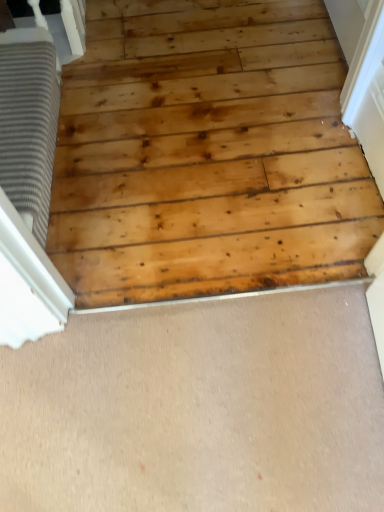
In order to face natural wood floor at upper left, should I rotate leftwards or rightwards?

Turn right approximately 2.594 degrees to face it.

The width and height of the screenshot is (384, 512). Describe the element at coordinates (207, 154) in the screenshot. I see `natural wood floor at upper left` at that location.

The width and height of the screenshot is (384, 512). I want to click on natural wood floor at upper left, so click(x=207, y=154).

The width and height of the screenshot is (384, 512). Find the location of `natural wood floor at upper left`. natural wood floor at upper left is located at coordinates (207, 154).